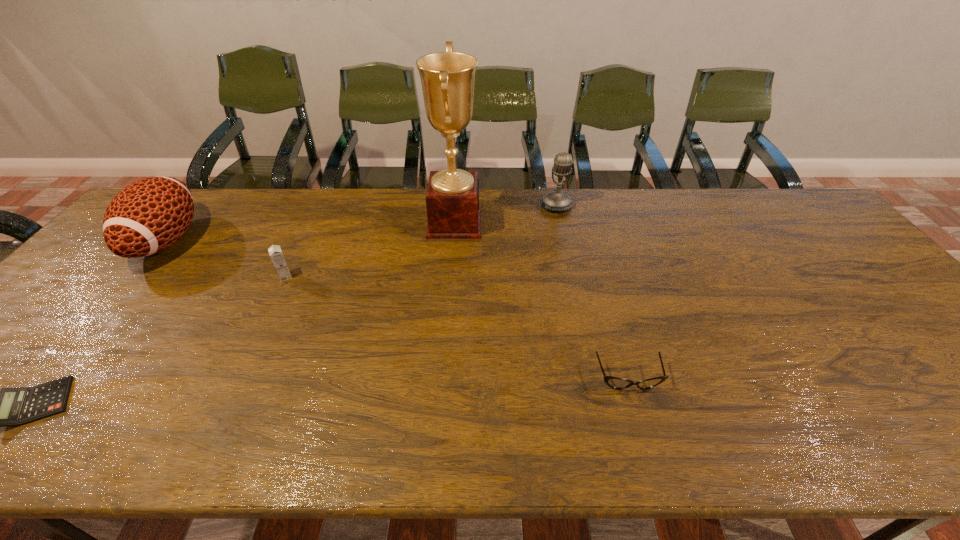
Locate an element on the screen. The height and width of the screenshot is (540, 960). trophy cup is located at coordinates (452, 200).

Locate an element on the screen. The height and width of the screenshot is (540, 960). the tallest object is located at coordinates (452, 200).

You are a GUI agent. You are given a task and a screenshot of the screen. Output one action in this format:
    pyautogui.click(x=<x>, y=<y>)
    Task: Click on the microphone
    Image resolution: width=960 pixels, height=540 pixels.
    Given the screenshot: What is the action you would take?
    pyautogui.click(x=557, y=200)

At what (x,y) coordinates should I click in order to perform the action: click on football. Please return your answer as a coordinate pair (x, y). Looking at the image, I should click on (148, 216).

Where is `the fourth object from right to left`? This screenshot has width=960, height=540. the fourth object from right to left is located at coordinates (275, 252).

The image size is (960, 540). I want to click on chocolate milk, so click(275, 252).

Identify the location of the fifth tallest object. (614, 382).

The image size is (960, 540). Identify the location of free space located 0.300m on the plaque of the third object from right to left. (574, 222).

Where is `free point located 0.110m on the front-facing side of the microphone`? The image size is (960, 540). free point located 0.110m on the front-facing side of the microphone is located at coordinates (564, 235).

I want to click on vacant space located on the front of the football, so click(44, 388).